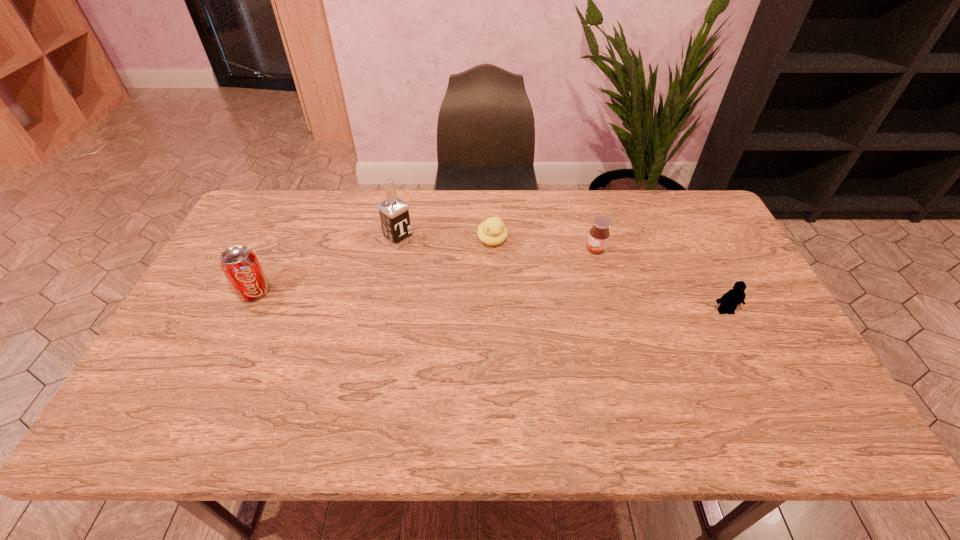
The image size is (960, 540). Find the location of `vodka located at the far edge`. vodka located at the far edge is located at coordinates (394, 214).

Where is `duckling at the far edge`? The width and height of the screenshot is (960, 540). duckling at the far edge is located at coordinates (492, 231).

Identify the location of object positioned at the left edge. The width and height of the screenshot is (960, 540). (240, 265).

Locate an element on the screen. The width and height of the screenshot is (960, 540). object that is at the right edge is located at coordinates (729, 301).

This screenshot has width=960, height=540. In the image, there is a desktop. In order to click on free region at the far edge in this screenshot , I will do `click(413, 216)`.

In order to click on free spot at the near edge of the desktop in this screenshot , I will do pos(328,384).

In the image, there is a desktop. Where is `vacant area at the right edge`? This screenshot has height=540, width=960. vacant area at the right edge is located at coordinates (729, 259).

Locate an element on the screen. empty location between the tallest object and the leftmost object is located at coordinates (326, 266).

Identify the location of free space between the shortest object and the second tallest object. (373, 266).

Where is `empty location between the Lego and the duckling`? The image size is (960, 540). empty location between the Lego and the duckling is located at coordinates (609, 275).